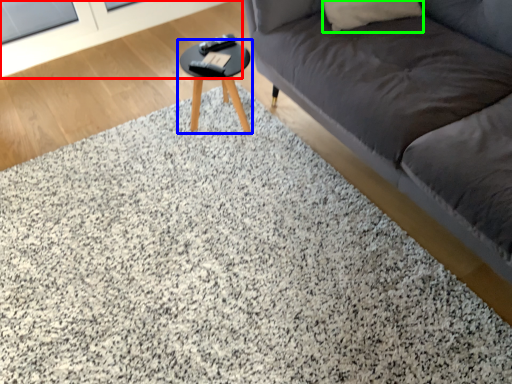
Question: Based on their relative distances, which object is nearer to screen door (highlighted by a red box)? Choose from table (highlighted by a blue box) and pillow (highlighted by a green box).

Choices:
 (A) table
 (B) pillow

Answer: (A)